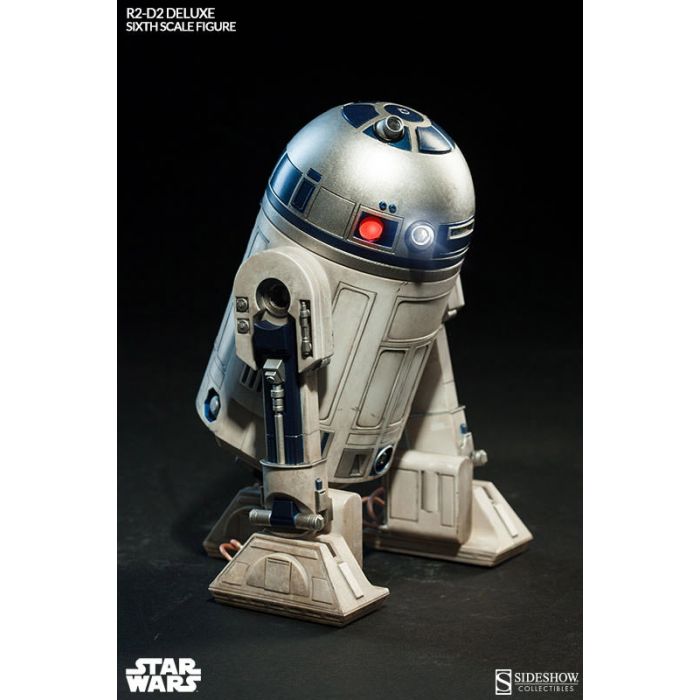
Identify the location of poster. Image resolution: width=700 pixels, height=700 pixels. (512, 189).